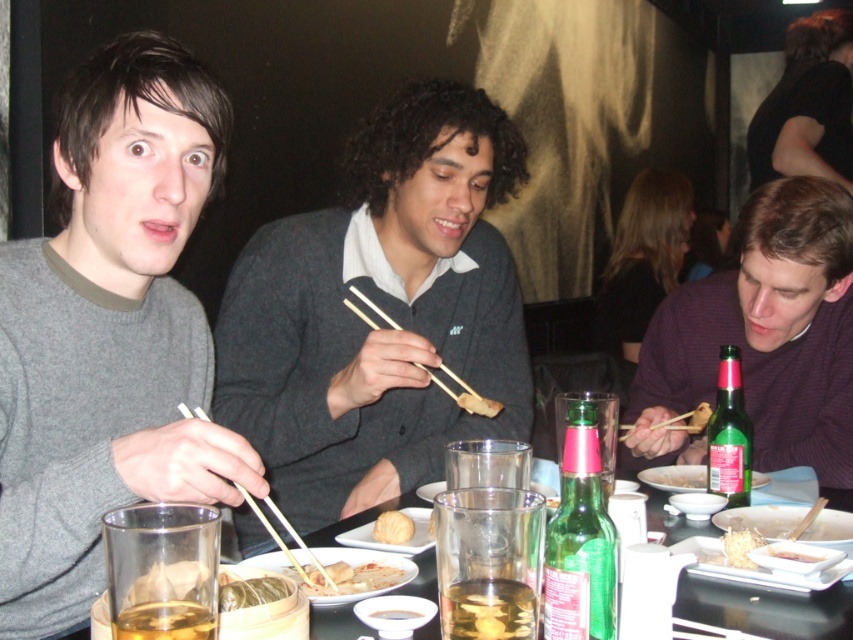
Question: Is the position of translucent glass at table center more distant than that of brown matte chopsticks at center?

Choices:
 (A) no
 (B) yes

Answer: (A)

Question: Can you confirm if green glass bottle at right is positioned to the left of wooden chopsticks at right?

Choices:
 (A) yes
 (B) no

Answer: (B)

Question: Does clear glass at center have a greater width compared to golden fried dumpling at center?

Choices:
 (A) no
 (B) yes

Answer: (B)

Question: Which of these objects is positioned farthest from the gray wool sweater at left?

Choices:
 (A) golden fried dumpling at center
 (B) purple knit sweater at right

Answer: (B)

Question: Which object is the farthest from the dark gray sweater at center?

Choices:
 (A) green glass bottle at center
 (B) shiny gold leaf at center
 (C) golden fried dough stick at center
 (D) clear glass at center

Answer: (B)

Question: Which of the following is the farthest from the observer?

Choices:
 (A) white crispy noodles at center
 (B) clear glass at center
 (C) wooden chopsticks at left

Answer: (A)